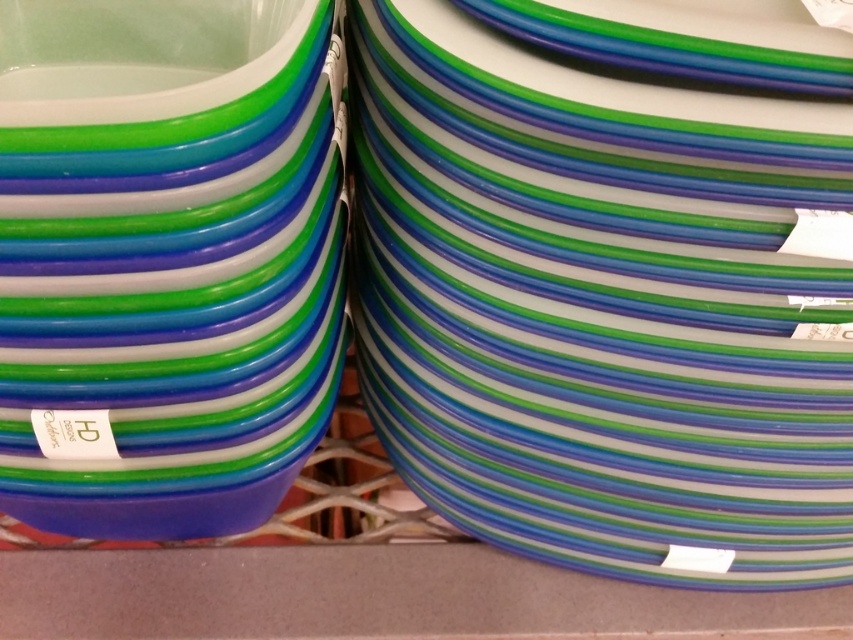
Question: Does matte plastic plate at center appear over matte plastic plate at left?

Choices:
 (A) no
 (B) yes

Answer: (A)

Question: Where is matte plastic plate at center located in relation to matte plastic plate at left in the image?

Choices:
 (A) above
 (B) below

Answer: (B)

Question: Does matte plastic plate at center have a lesser width compared to matte plastic plate at left?

Choices:
 (A) no
 (B) yes

Answer: (A)

Question: Among these points, which one is farthest from the camera?

Choices:
 (A) (169, 36)
 (B) (517, 396)

Answer: (A)

Question: Which of the following is the closest to the observer?

Choices:
 (A) (102, 193)
 (B) (579, 214)

Answer: (A)

Question: Which point is farther to the camera?

Choices:
 (A) (585, 257)
 (B) (106, 454)

Answer: (B)